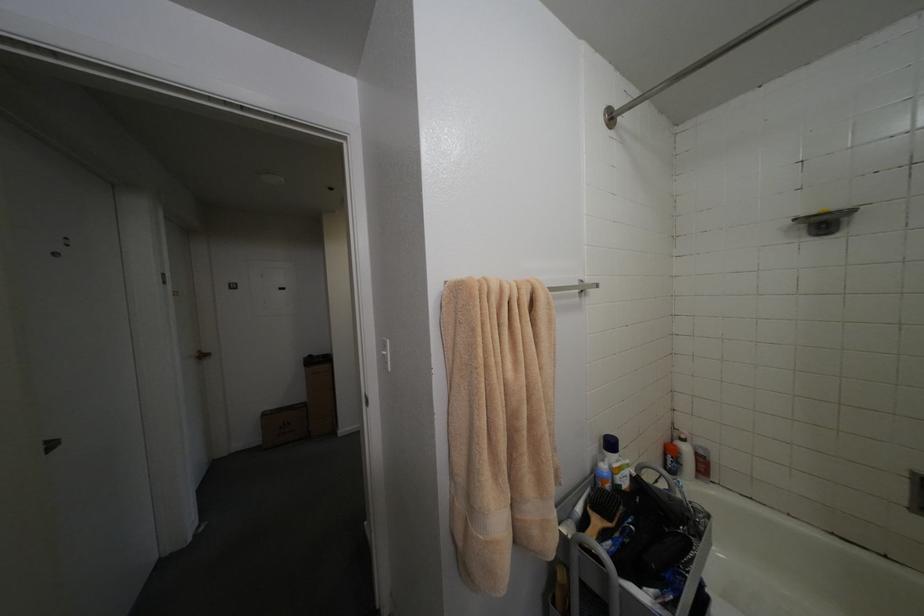
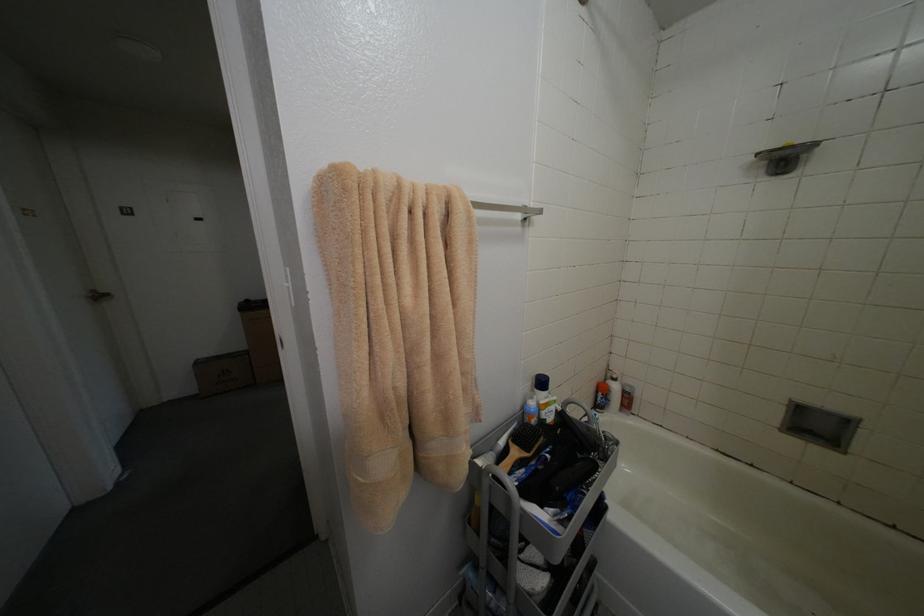
Question: Based on the continuous images, in which direction is the camera rotating? Reply with the corresponding letter.

Choices:
 (A) Left
 (B) Right
 (C) Up
 (D) Down

Answer: (D)